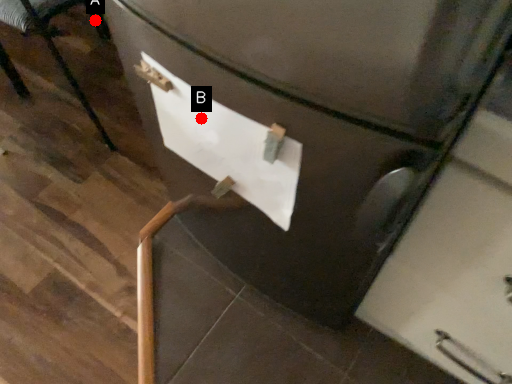
Question: Two points are circled on the image, labeled by A and B beside each circle. Which point is farther from the camera taking this photo?

Choices:
 (A) A is further
 (B) B is further

Answer: (A)